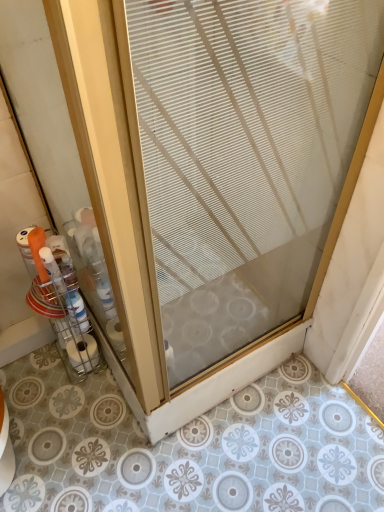
Question: Looking at the image, does white matte toilet paper at lower left seem bigger or smaller compared to clear glass door at center?

Choices:
 (A) small
 (B) big

Answer: (A)

Question: Choose the correct answer: Is white matte toilet paper at lower left inside clear glass door at center or outside it?

Choices:
 (A) inside
 (B) outside

Answer: (B)

Question: Estimate the real-world distances between objects in this image. Which object is farther from the clear glass door at center?

Choices:
 (A) clear plastic container at left
 (B) white matte toilet paper at lower left

Answer: (B)

Question: Based on their relative distances, which object is farther from the clear plastic container at left?

Choices:
 (A) clear glass door at center
 (B) white matte toilet paper at lower left

Answer: (A)